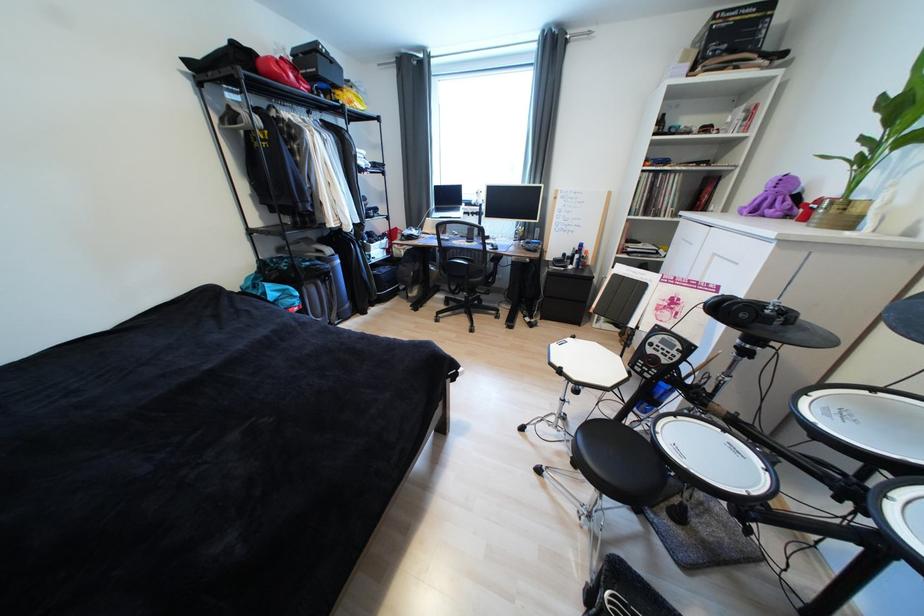
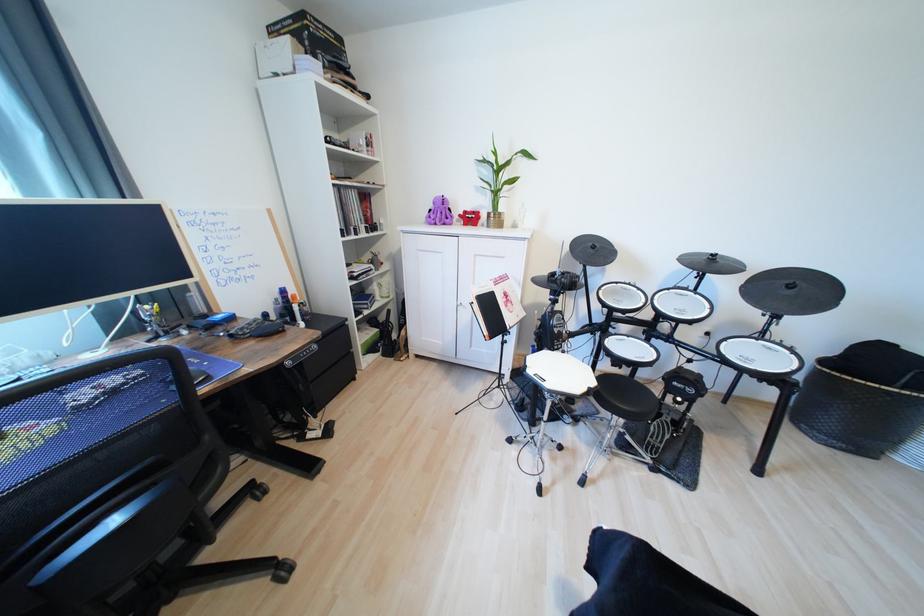
Where in the second image is the point corresponding to [664,310] from the first image?

(513, 307)